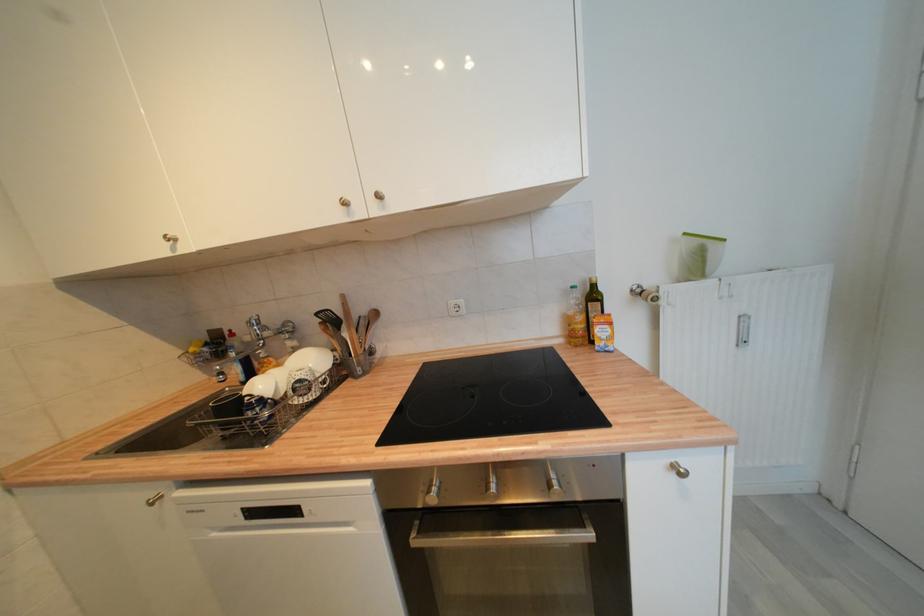
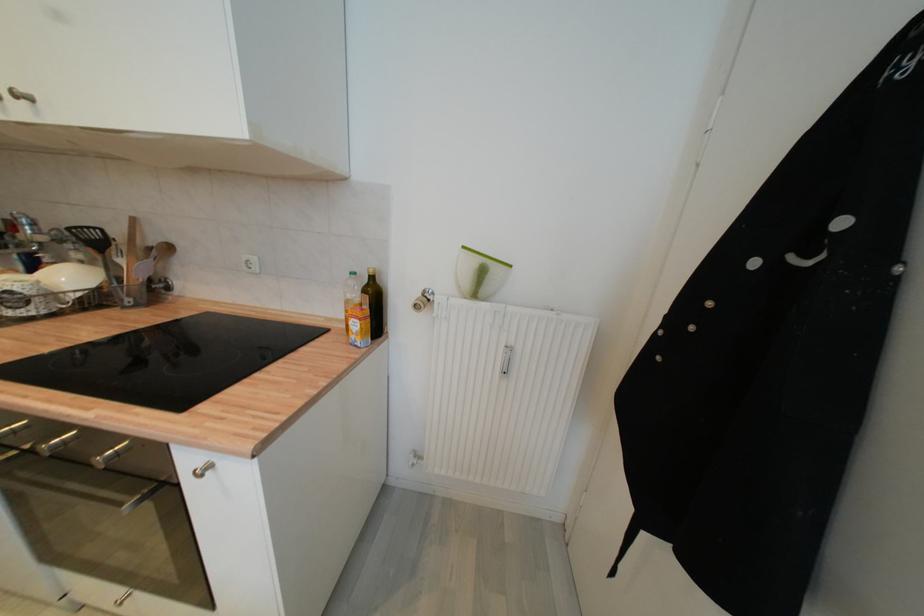
Question: In a continuous first-person perspective shot, in which direction is the camera moving?

Choices:
 (A) Left
 (B) Right
 (C) Forward
 (D) Backward

Answer: (B)